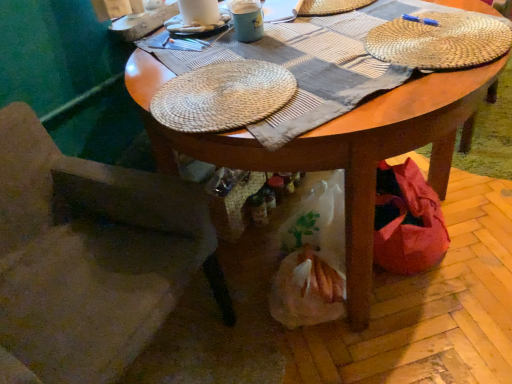
Question: Is woven straw placemat at upper right, which appears as the 2th hat when viewed from the top, looking in the opposite direction of white woven hat at upper center, the third hat from the bottom?

Choices:
 (A) no
 (B) yes

Answer: (A)

Question: Is white woven hat at upper center, the third hat from the bottom, surrounded by woven straw placemat at upper right, which appears as the 2th hat when ordered from the bottom?

Choices:
 (A) no
 (B) yes

Answer: (A)

Question: Could you tell me if woven straw placemat at upper right, which appears as the 2th hat when viewed from the top, is turned towards white woven hat at upper center, the 1th hat from the top?

Choices:
 (A) yes
 (B) no

Answer: (B)

Question: Is woven straw placemat at upper right, which appears as the 2th hat when ordered from the bottom, not close to white woven hat at upper center, the 1th hat from the top?

Choices:
 (A) no
 (B) yes

Answer: (A)

Question: Is the position of woven straw placemat at upper right, which appears as the 2th hat when ordered from the bottom, more distant than that of white woven hat at upper center, the third hat from the bottom?

Choices:
 (A) no
 (B) yes

Answer: (A)

Question: Is woven straw placemat at upper right, which appears as the 2th hat when viewed from the top, inside the boundaries of woven straw placemat at center, which is the first hat in bottom-to-top order, or outside?

Choices:
 (A) inside
 (B) outside

Answer: (B)

Question: Looking at the image, does woven straw placemat at upper right, which appears as the 2th hat when ordered from the bottom, seem bigger or smaller compared to woven straw placemat at center, which is the 3th hat in top-to-bottom order?

Choices:
 (A) small
 (B) big

Answer: (A)

Question: Would you say woven straw placemat at upper right, which appears as the 2th hat when ordered from the bottom, is to the left or to the right of woven straw placemat at center, which is the 3th hat in top-to-bottom order, in the picture?

Choices:
 (A) right
 (B) left

Answer: (A)

Question: Is woven straw placemat at upper right, which appears as the 2th hat when viewed from the top, wider or thinner than woven straw placemat at center, which is the first hat in bottom-to-top order?

Choices:
 (A) thin
 (B) wide

Answer: (A)

Question: Do you think white woven hat at upper center, the third hat from the bottom, is within matte ceramic mug at upper center, or outside of it?

Choices:
 (A) inside
 (B) outside

Answer: (B)

Question: Is white woven hat at upper center, the 1th hat from the top, wider or thinner than matte ceramic mug at upper center?

Choices:
 (A) thin
 (B) wide

Answer: (B)

Question: Considering their positions, is white woven hat at upper center, the 1th hat from the top, located in front of or behind matte ceramic mug at upper center?

Choices:
 (A) behind
 (B) front

Answer: (A)

Question: Visually, is white woven hat at upper center, the third hat from the bottom, positioned to the left or to the right of matte ceramic mug at upper center?

Choices:
 (A) right
 (B) left

Answer: (A)

Question: Is suede-like beige chair at lower left to the left or to the right of woven straw placemat at center, which is the 3th hat in top-to-bottom order, in the image?

Choices:
 (A) right
 (B) left

Answer: (B)

Question: In terms of width, does suede-like beige chair at lower left look wider or thinner when compared to woven straw placemat at center, which is the 3th hat in top-to-bottom order?

Choices:
 (A) thin
 (B) wide

Answer: (B)